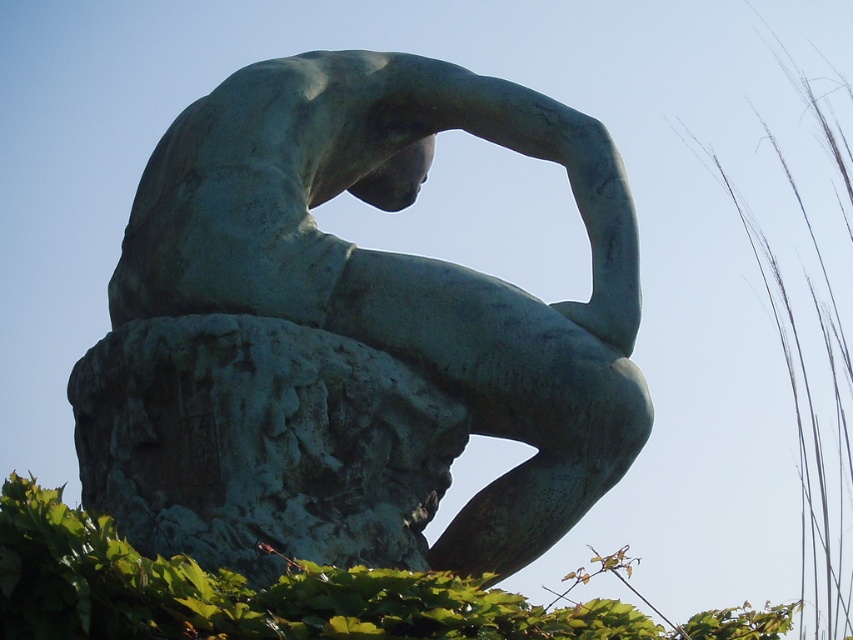
Question: Which point is farther from the camera taking this photo?

Choices:
 (A) (616, 636)
 (B) (358, 285)

Answer: (B)

Question: Does green patina stone sculpture at center have a lesser width compared to green leafy hedge at lower left?

Choices:
 (A) yes
 (B) no

Answer: (A)

Question: Where is green patina stone sculpture at center located in relation to green leafy hedge at lower left in the image?

Choices:
 (A) above
 (B) below

Answer: (A)

Question: Among these objects, which one is farthest from the camera?

Choices:
 (A) green patina stone sculpture at center
 (B) green leafy hedge at lower left

Answer: (A)

Question: Does green patina stone sculpture at center have a larger size compared to green leafy hedge at lower left?

Choices:
 (A) yes
 (B) no

Answer: (B)